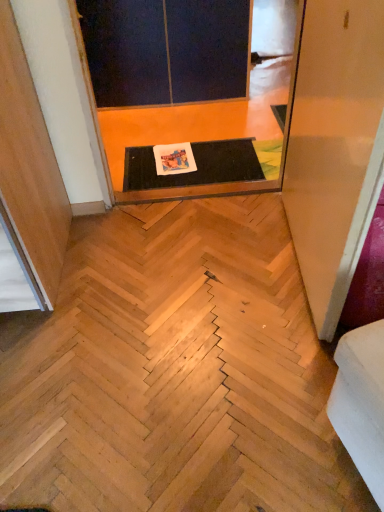
Find the location of a particular element. This screenshot has height=512, width=384. free space above natural wood stairwell at center (from a real-world perspective) is located at coordinates (187, 345).